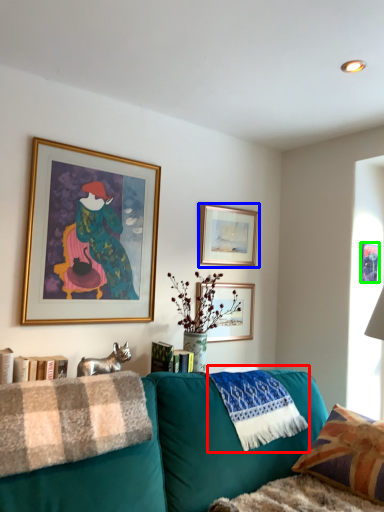
Question: Which is nearer to the material (highlighted by a red box)? picture frame (highlighted by a blue box) or picture frame (highlighted by a green box).

Choices:
 (A) picture frame
 (B) picture frame

Answer: (A)